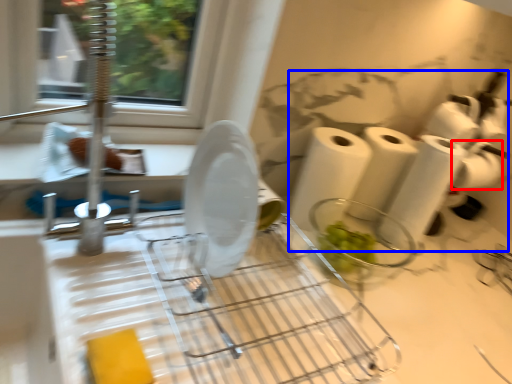
Question: Which object appears closest to the camera in this image, toilet paper (highlighted by a red box) or toilet paper (highlighted by a blue box)?

Choices:
 (A) toilet paper
 (B) toilet paper

Answer: (B)